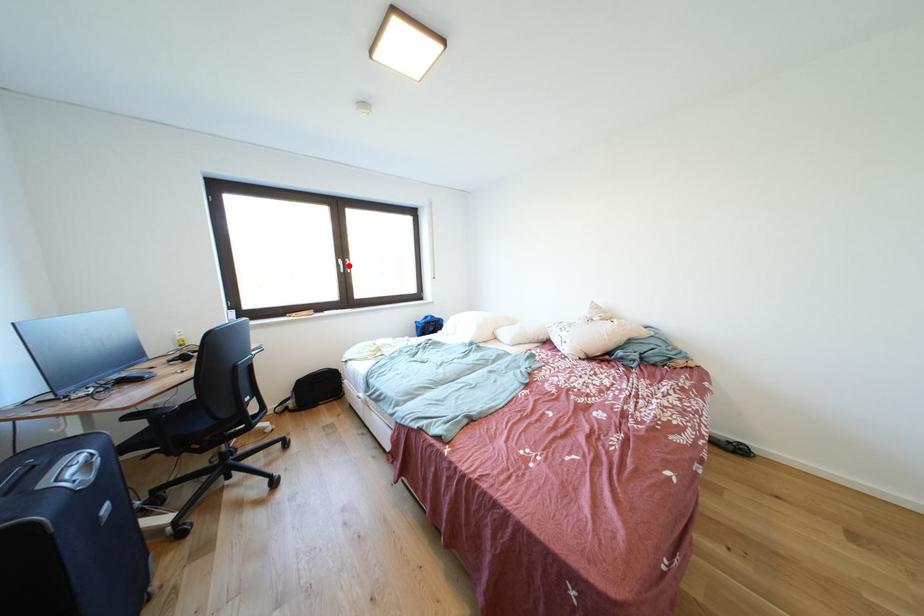
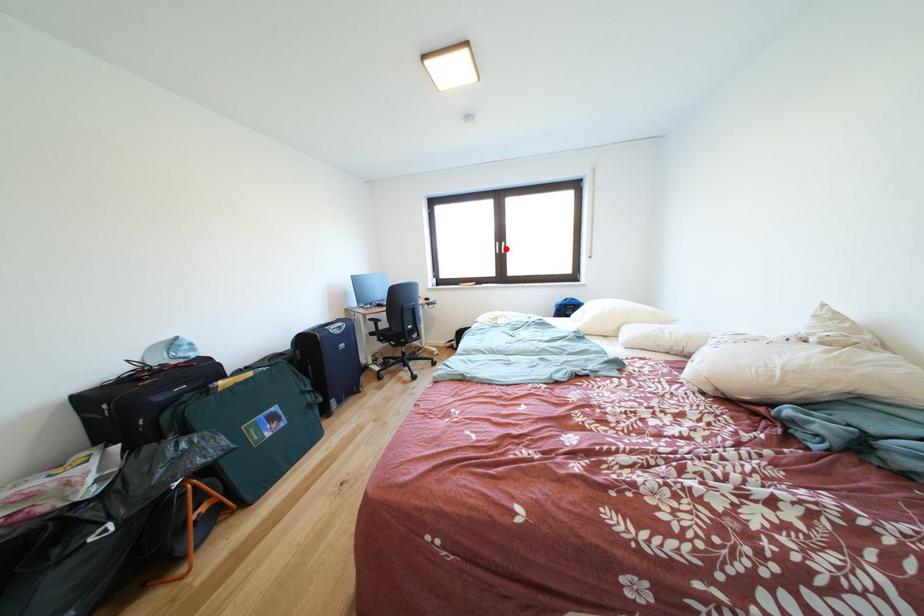
I am providing you with two images of the same scene from different viewpoints. A red point is marked on the first image and another point is marked on the second image. Do the highlighted points in image1 and image2 indicate the same real-world spot?

Yes